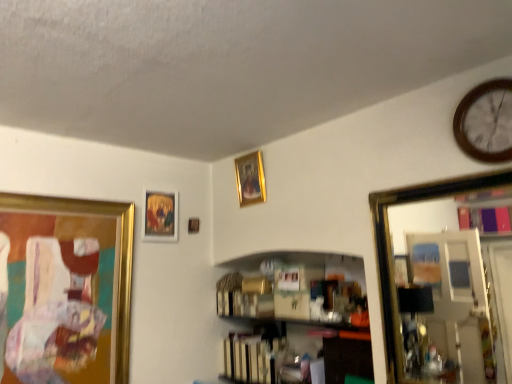
Question: Would you say gold metallic picture frame at left, the 1th picture frame from the left, is inside or outside gold-framed mirror at right?

Choices:
 (A) outside
 (B) inside

Answer: (A)

Question: In the image, is gold metallic picture frame at left, the 1th picture frame from the left, positioned in front of or behind gold-framed mirror at right?

Choices:
 (A) behind
 (B) front

Answer: (A)

Question: Estimate the real-world distances between objects in this image. Which object is closer to the gold metallic picture frame at left, the 4th picture frame when ordered from right to left?

Choices:
 (A) gold metallic picture frame at upper center, which is the 1th picture frame in right-to-left order
 (B) wooden picture frame at upper center, which is the second picture frame in right-to-left order
 (C) gold-framed painting at upper center, arranged as the 2th picture frame when viewed from the left
 (D) brown wooden clock at upper right
 (E) gold-framed mirror at right

Answer: (C)

Question: Estimate the real-world distances between objects in this image. Which object is farther from the gold-framed painting at upper center, positioned as the 3th picture frame in right-to-left order?

Choices:
 (A) gold metallic picture frame at upper center, which is the 1th picture frame in right-to-left order
 (B) gold-framed mirror at right
 (C) wooden picture frame at upper center, which is the second picture frame in right-to-left order
 (D) brown wooden clock at upper right
 (E) gold metallic picture frame at left, the 4th picture frame when ordered from right to left

Answer: (D)